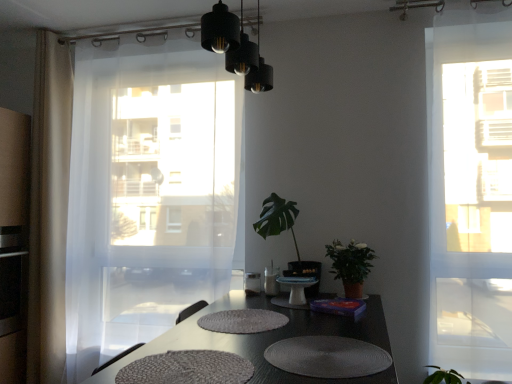
Find the location of `white textured placemat at lower center, arranged as the 1th wide when viewed from the right`. white textured placemat at lower center, arranged as the 1th wide when viewed from the right is located at coordinates (327, 357).

The image size is (512, 384). What do you see at coordinates (350, 265) in the screenshot?
I see `green matte plant at right, the second houseplant from the left` at bounding box center [350, 265].

Where is `black matte light fixture at upper center`? This screenshot has height=384, width=512. black matte light fixture at upper center is located at coordinates (236, 47).

From a real-world perspective, count 1st houseplants downward from the transparent white curtain at left, the 1th curtain viewed from the right, and point to it. Please provide its 2D coordinates.

[(292, 236)]

Between transparent white curtain at left, marked as the 2th curtain in a left-to-right arrangement, and green matte plant at center, marked as the second houseplant in a right-to-left arrangement, which one has more height?

transparent white curtain at left, marked as the 2th curtain in a left-to-right arrangement.

Can you confirm if textured gray placemats at center is shorter than white textured placemat at center?

No, textured gray placemats at center is not shorter than white textured placemat at center.

Does point (166, 344) lie in front of point (220, 328)?

No, it is not.

Locate an element on the screen. This screenshot has width=512, height=384. mat located above the textured gray placemats at center (from a real-world perspective) is located at coordinates (242, 321).

Who is bigger, textured gray placemats at center or white textured placemat at center?

Bigger between the two is textured gray placemats at center.

Identify the location of window above the green matte plant at center, marked as the second houseplant in a right-to-left arrangement (from a real-world perspective). (471, 193).

Could you measure the distance between transparent glass window at right and green matte plant at center, marked as the second houseplant in a right-to-left arrangement?

transparent glass window at right and green matte plant at center, marked as the second houseplant in a right-to-left arrangement, are 81.41 centimeters apart from each other.

Is transparent glass window at right further to the viewer compared to green matte plant at center, the 1th houseplant from the left?

No, transparent glass window at right is closer to the camera.

Is point (492, 117) farther from viewer compared to point (307, 296)?

No, (492, 117) is in front of (307, 296).

Does gray woven placemat at lower center, arranged as the second wide when viewed from the right, have a lesser width compared to white textured placemat at center?

No.

Relative to white textured placemat at center, is gray woven placemat at lower center, arranged as the second wide when viewed from the right, in front or behind?

gray woven placemat at lower center, arranged as the second wide when viewed from the right, is in front of white textured placemat at center.

From a real-world perspective, who is located higher, gray woven placemat at lower center, arranged as the second wide when viewed from the right, or white textured placemat at center?

white textured placemat at center is physically above.

Is gray woven placemat at lower center, arranged as the second wide when viewed from the right, facing away from white textured placemat at center?

gray woven placemat at lower center, arranged as the second wide when viewed from the right, does not have its back to white textured placemat at center.

From the image's perspective, between white textured placemat at center and transparent glass window at right, who is located below?

From the image's view, white textured placemat at center is below.

In the scene shown: Is white textured placemat at center next to transparent glass window at right?

No, white textured placemat at center is not touching transparent glass window at right.

Is transparent glass window at right at the back of white textured placemat at center?

No.

Is white textured placemat at center facing towards gray woven placemat at lower center, arranged as the second wide when viewed from the right?

No, white textured placemat at center is not oriented towards gray woven placemat at lower center, arranged as the second wide when viewed from the right.

From the image's perspective, is white textured placemat at center located above or below gray woven placemat at lower center, arranged as the second wide when viewed from the right?

Based on their image positions, white textured placemat at center is located beneath gray woven placemat at lower center, arranged as the second wide when viewed from the right.

Are white textured placemat at center and gray woven placemat at lower center, arranged as the second wide when viewed from the right, located far from each other?

That's not correct — white textured placemat at center is a little close to gray woven placemat at lower center, arranged as the second wide when viewed from the right.

Does transparent glass window at right come in front of white glossy cake stand at center?

Yes, the depth of transparent glass window at right is less than that of white glossy cake stand at center.

From a real-world perspective, is transparent glass window at right physically located above or below white glossy cake stand at center?

From a real-world perspective, transparent glass window at right is physically above white glossy cake stand at center.

Is transparent glass window at right directly adjacent to white glossy cake stand at center?

transparent glass window at right and white glossy cake stand at center are not in contact.

Is transparent glass window at right wider or thinner than white glossy cake stand at center?

In the image, transparent glass window at right appears to be more narrow than white glossy cake stand at center.

What are the coordinates of `the 1st houseplant in front of the transparent white curtain at left, marked as the 2th curtain in a left-to-right arrangement, starting your count from the anchor` in the screenshot? It's located at (292, 236).

Find the location of a particular element. mat located above the textured gray placemats at center (from a real-world perspective) is located at coordinates (242, 321).

In the scene shown: Which object lies nearer to the anchor point transparent glass window at right, green matte plant at center, the 1th houseplant from the left, or gray woven placemat at lower center, arranged as the 1th wide when viewed from the left?

green matte plant at center, the 1th houseplant from the left.

Which object lies nearer to the anchor point white glossy cake stand at center, textured gray placemats at center or green matte plant at center, marked as the second houseplant in a right-to-left arrangement?

green matte plant at center, marked as the second houseplant in a right-to-left arrangement, is closer to white glossy cake stand at center.

Based on their spatial positions, is black matte light fixture at upper center or transparent white curtain at left, marked as the 2th curtain in a left-to-right arrangement, closer to gray woven placemat at lower center, arranged as the second wide when viewed from the right?

black matte light fixture at upper center lies closer to gray woven placemat at lower center, arranged as the second wide when viewed from the right, than the other object.

In the scene shown: Which object lies further to the anchor point white textured placemat at center, green matte plant at right, the second houseplant from the left, or transparent glass window at right?

Based on the image, transparent glass window at right appears to be further to white textured placemat at center.

Estimate the real-world distances between objects in this image. Which object is further from white textured placemat at center, transparent white curtain at left, the 1th curtain viewed from the right, or green matte plant at right, the first houseplant viewed from the right?

The object further to white textured placemat at center is transparent white curtain at left, the 1th curtain viewed from the right.

Estimate the real-world distances between objects in this image. Which object is further from white textured placemat at center, white glossy cake stand at center or green matte plant at right, the first houseplant viewed from the right?

green matte plant at right, the first houseplant viewed from the right, is positioned further to the anchor white textured placemat at center.

Looking at the image, which one is located further to white textured placemat at center, white textured placemat at lower center, arranged as the 1th wide when viewed from the right, or transparent glass window at right?

Based on the image, transparent glass window at right appears to be further to white textured placemat at center.

From the picture: From the image, which object appears to be nearer to gray woven placemat at lower center, arranged as the second wide when viewed from the right, textured gray placemats at center or green matte plant at right, the second houseplant from the left?

Among the two, textured gray placemats at center is located nearer to gray woven placemat at lower center, arranged as the second wide when viewed from the right.

You are a GUI agent. You are given a task and a screenshot of the screen. Output one action in this format:
    pyautogui.click(x=<x>, y=<y>)
    Task: Click on the round table between textured gray placemats at center and green matte plant at center, marked as the second houseplant in a right-to-left arrangement, in the front-back direction
    
    Given the screenshot: What is the action you would take?
    pyautogui.click(x=294, y=292)

What are the coordinates of `lighting between gray woven placemat at lower center, arranged as the 1th wide when viewed from the left, and transparent glass window at right, in the horizontal direction` in the screenshot? It's located at (236, 47).

Locate an element on the screen. houseplant between beige sheer curtain at left, acting as the 1th curtain starting from the left, and green matte plant at right, the second houseplant from the left, in the horizontal direction is located at coordinates (292, 236).

Where is `wide located between gray woven placemat at lower center, arranged as the 1th wide when viewed from the left, and white glossy cake stand at center in the depth direction`? wide located between gray woven placemat at lower center, arranged as the 1th wide when viewed from the left, and white glossy cake stand at center in the depth direction is located at coordinates (327, 357).